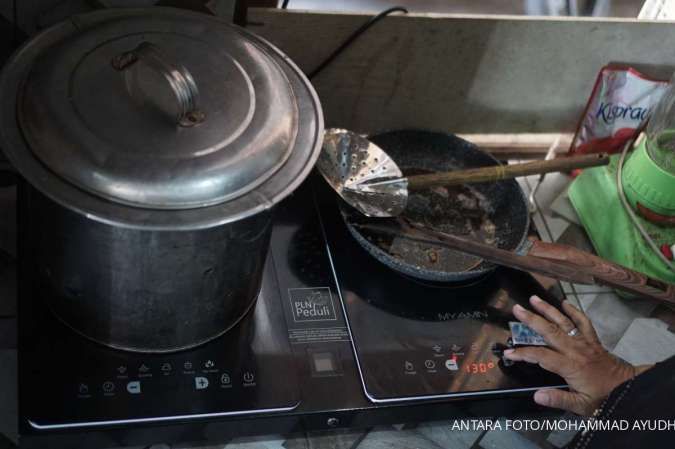
Identify the location of blender. The width and height of the screenshot is (675, 449). click(649, 183).